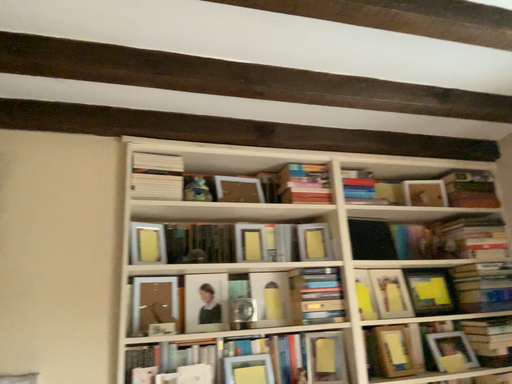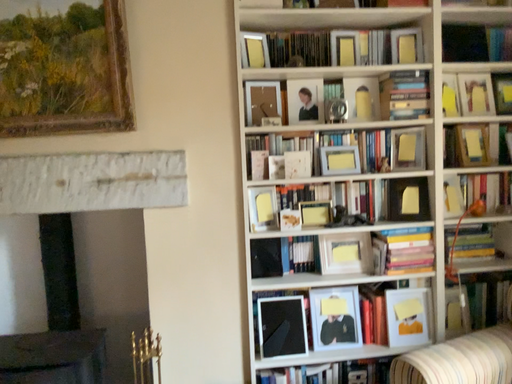
Question: How did the camera likely rotate when shooting the video?

Choices:
 (A) rotated right
 (B) rotated left

Answer: (B)